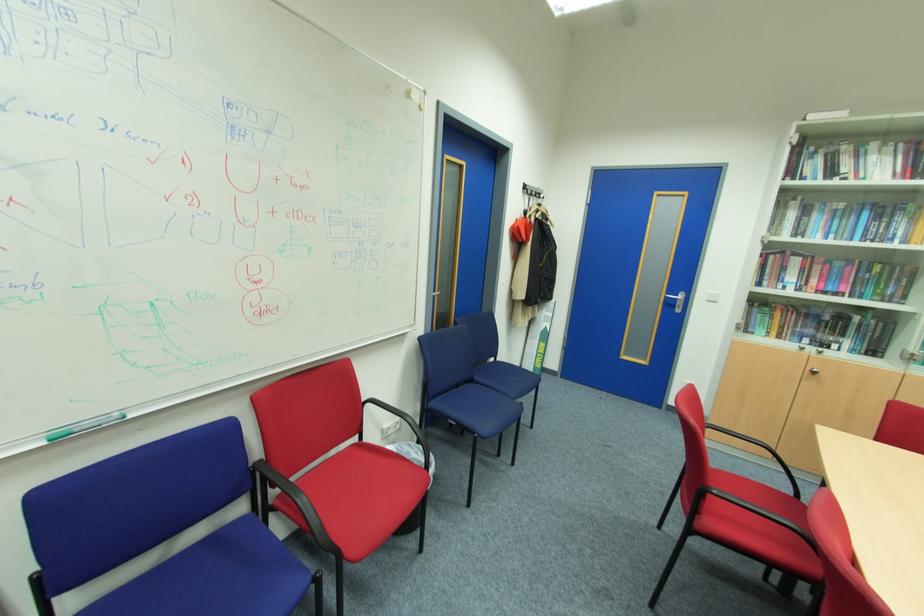
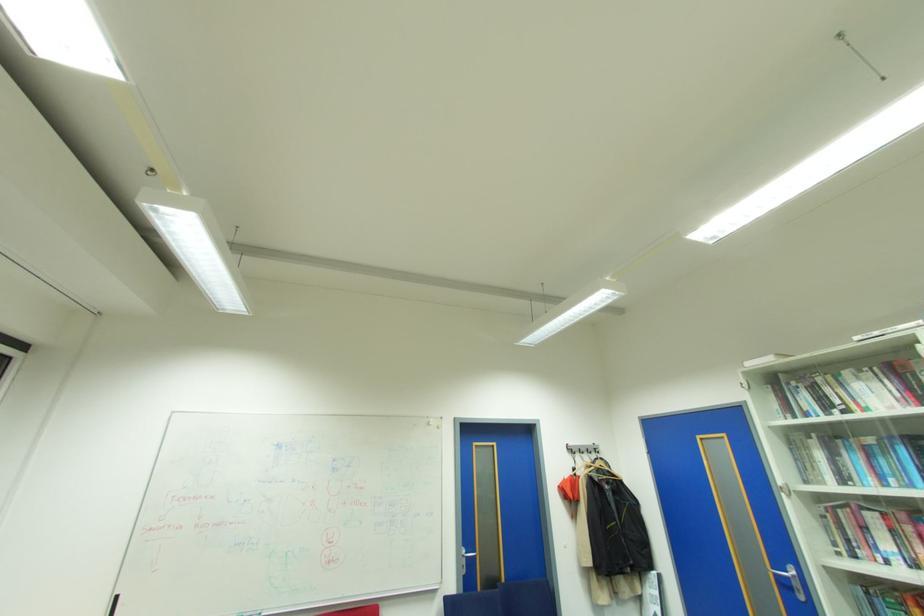
The point at (679, 300) is marked in the first image. Where is the corresponding point in the second image?

(791, 578)